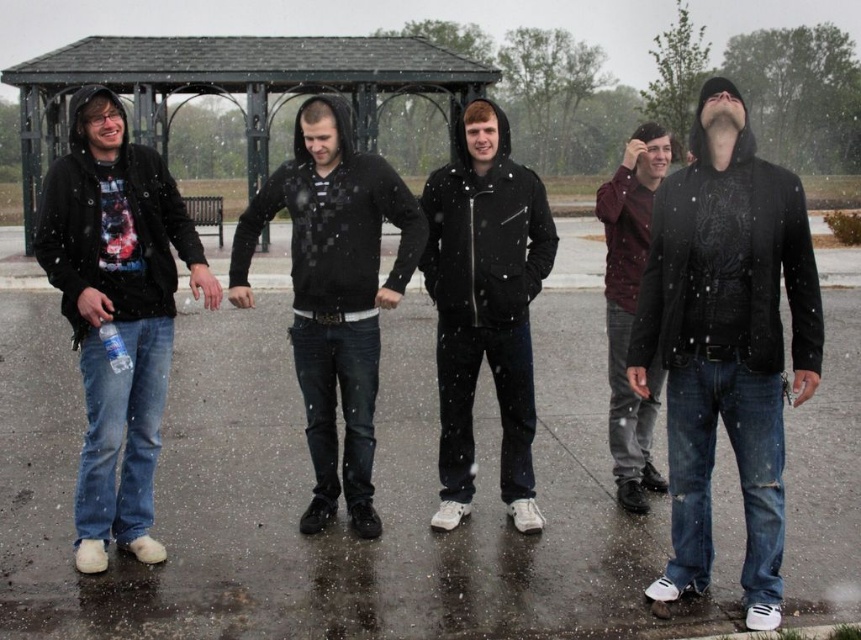
Who is lower down, black matte hoodie at right or matte black jacket at center?

Positioned lower is black matte hoodie at right.

Between point (729, 426) and point (496, 314), which one is positioned behind?

The point (496, 314) is more distant.

Locate an element on the screen. black matte hoodie at right is located at coordinates (726, 340).

Locate an element on the screen. This screenshot has width=861, height=640. black matte hoodie at right is located at coordinates (726, 340).

Can you confirm if matte black hoodie at center is taller than matte black jacket at center?

Incorrect, matte black hoodie at center's height is not larger of matte black jacket at center's.

Does matte black hoodie at center lie behind matte black jacket at center?

No, it is not.

What do you see at coordinates (333, 292) in the screenshot?
I see `matte black hoodie at center` at bounding box center [333, 292].

You are a GUI agent. You are given a task and a screenshot of the screen. Output one action in this format:
    pyautogui.click(x=<x>, y=<y>)
    Task: Click on the matte black hoodie at center
    The height and width of the screenshot is (640, 861).
    Given the screenshot: What is the action you would take?
    pyautogui.click(x=333, y=292)

Between black matte hoodie at right and matte black hoodie at center, which one has less height?

With less height is black matte hoodie at right.

Is point (697, 244) farther from camera compared to point (404, 260)?

That is False.

Locate an element on the screen. The height and width of the screenshot is (640, 861). black matte hoodie at right is located at coordinates (726, 340).